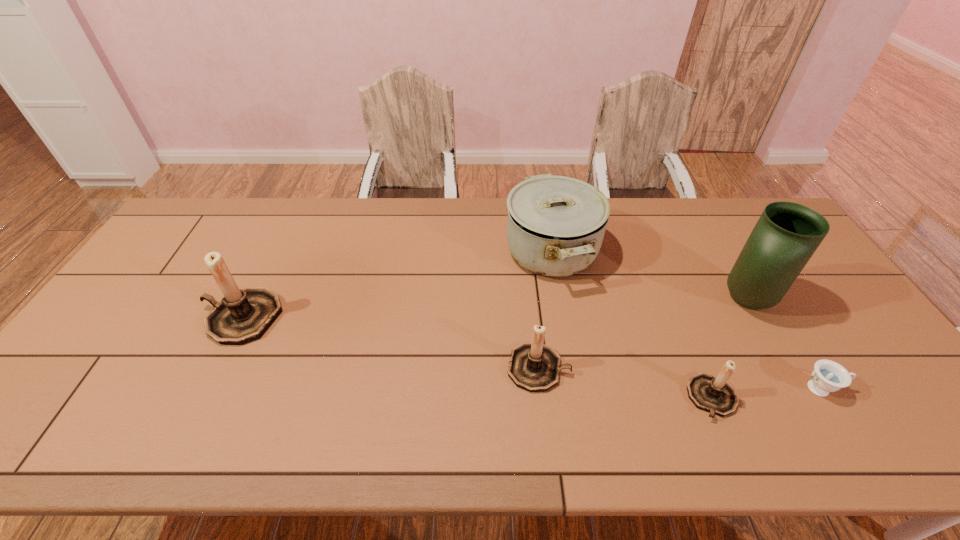
If equal spacing is the goal by inserting an additional candle_holder among them, please point out a vacant space for this new candle_holder. Please provide its 2D coordinates. Your answer should be formatted as a tuple, i.e. [(x, y)], where the tuple contains the x and y coordinates of a point satisfying the conditions above.

[(382, 341)]